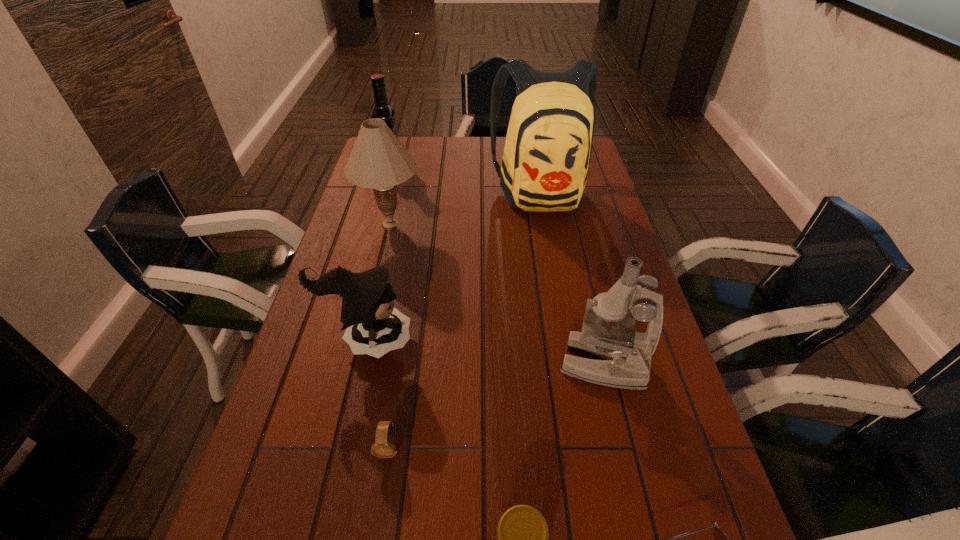
At what (x,y) coordinates should I click in order to perform the action: click on vacant space located on the left of the microscope. Please return your answer as a coordinate pair (x, y). Looking at the image, I should click on (506, 364).

Image resolution: width=960 pixels, height=540 pixels. I want to click on vacant position located at the face of the fifth tallest object, so click(x=547, y=340).

You are a GUI agent. You are given a task and a screenshot of the screen. Output one action in this format:
    pyautogui.click(x=<x>, y=<y>)
    Task: Click on the free space located on the face of the watch
    The image size is (960, 540).
    Given the screenshot: What is the action you would take?
    pyautogui.click(x=378, y=513)

Image resolution: width=960 pixels, height=540 pixels. Find the location of `backpack present at the far edge`. backpack present at the far edge is located at coordinates (548, 146).

This screenshot has height=540, width=960. I want to click on liquor at the far edge, so click(382, 110).

Identify the location of lampshade that is at the left edge. This screenshot has width=960, height=540. pos(378,160).

Locate an element on the screen. liquor positioned at the left edge is located at coordinates (382, 110).

What are the coordinates of `doll that is at the left edge` in the screenshot? It's located at (374, 326).

Where is `backpack located at the right edge`? This screenshot has width=960, height=540. backpack located at the right edge is located at coordinates (548, 146).

Where is `microscope located in the right edge section of the desktop`? The width and height of the screenshot is (960, 540). microscope located in the right edge section of the desktop is located at coordinates click(624, 355).